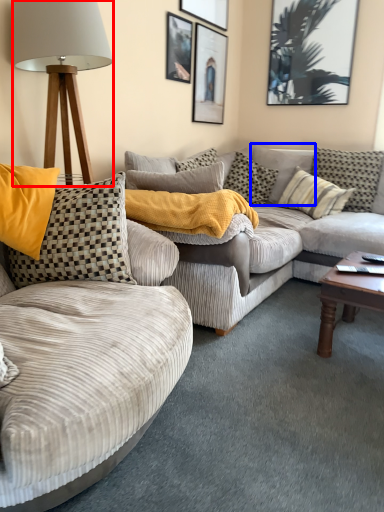
Question: Which object appears farthest to the camera in this image, lamp (highlighted by a red box) or pillow (highlighted by a blue box)?

Choices:
 (A) lamp
 (B) pillow

Answer: (B)